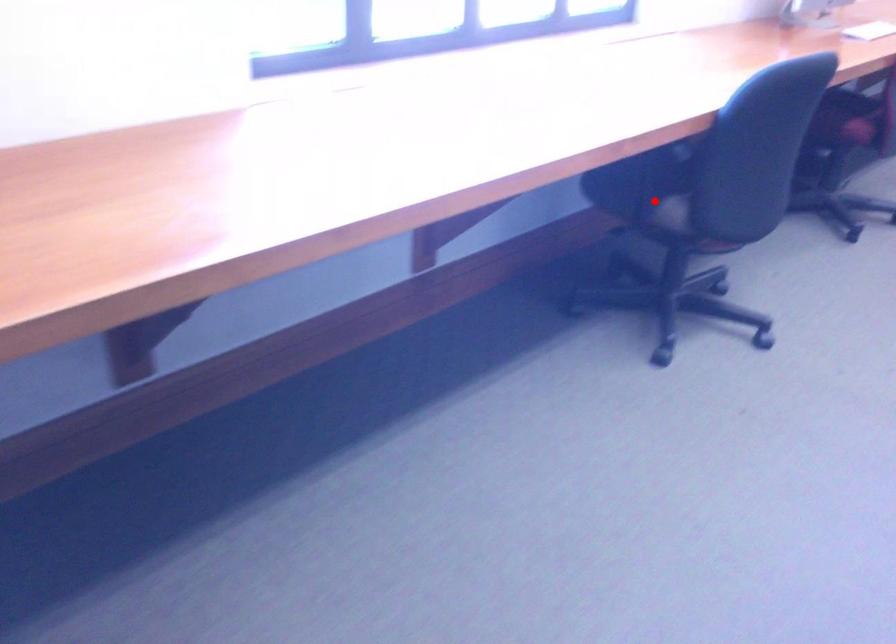
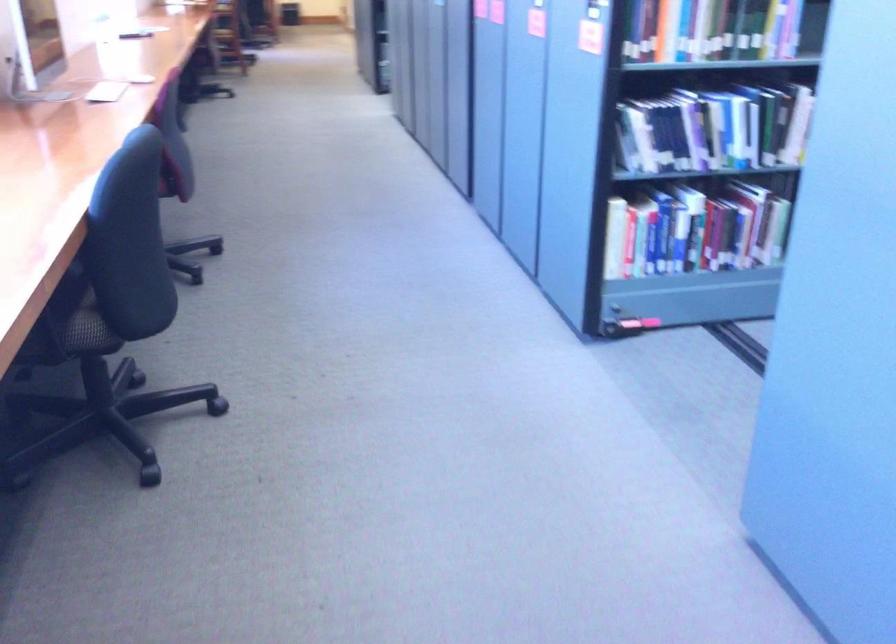
Question: I am providing you with two images of the same scene from different viewpoints. A red point is marked on the first image. Can you still see the location of the red point in image 2?

Choices:
 (A) Yes
 (B) No

Answer: (A)